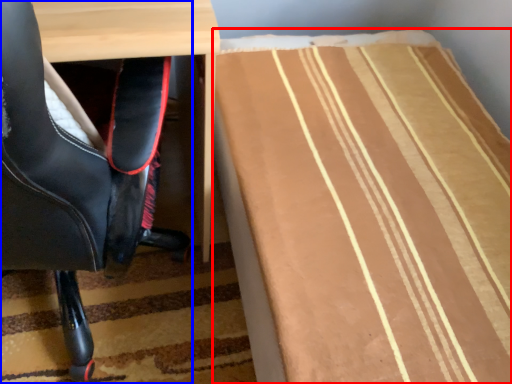
Question: Among these objects, which one is nearest to the camera, table (highlighted by a red box) or chair (highlighted by a blue box)?

Choices:
 (A) table
 (B) chair

Answer: (B)